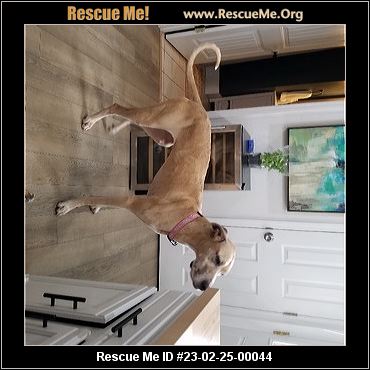
The image size is (370, 370). Identify the location of indoor plant. (258, 161).